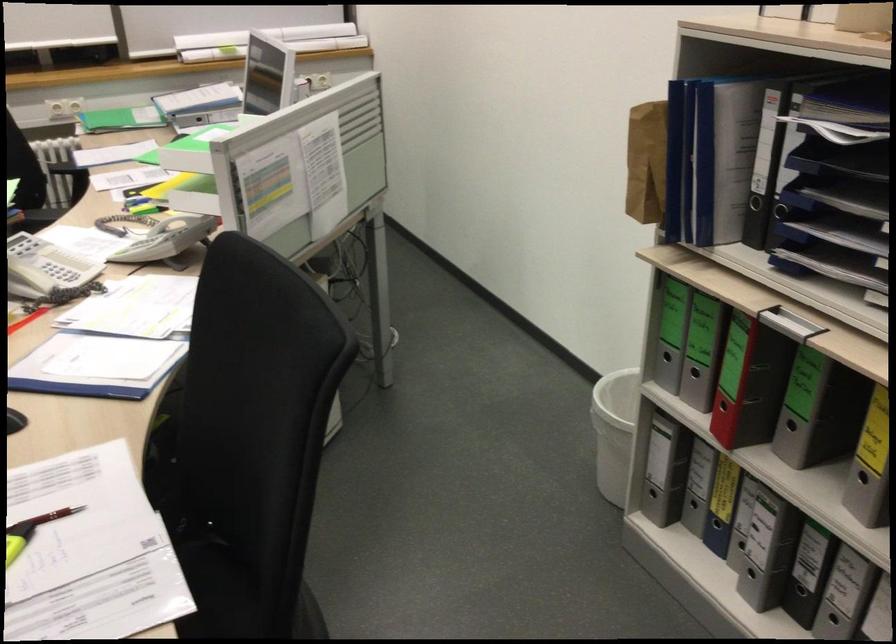
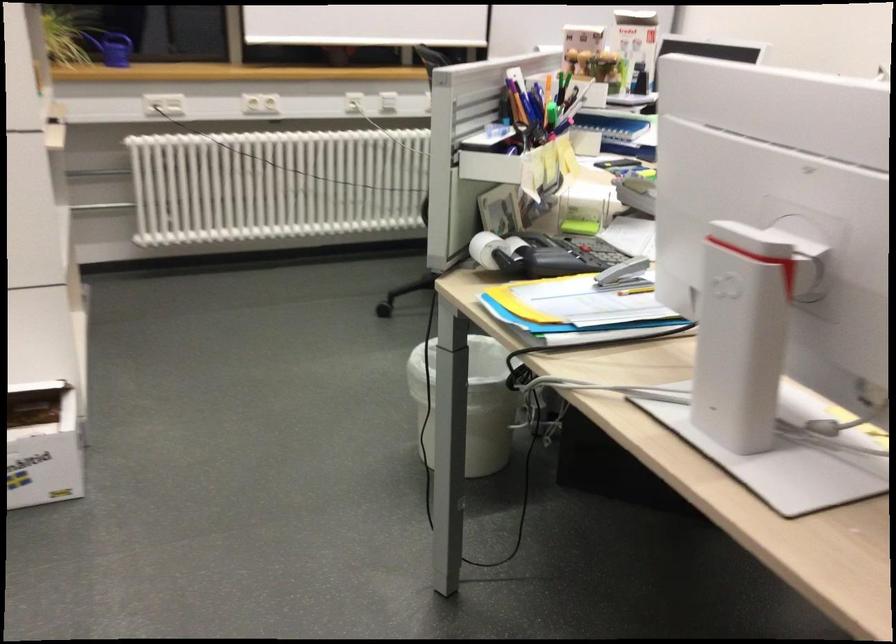
Question: I am providing you with two images of the same scene from different viewpoints. Which of the following objects are not visible in image2?

Choices:
 (A) red pen
 (B) blue pen
 (C) digital display clock
 (D) white cardboard box

Answer: (A)